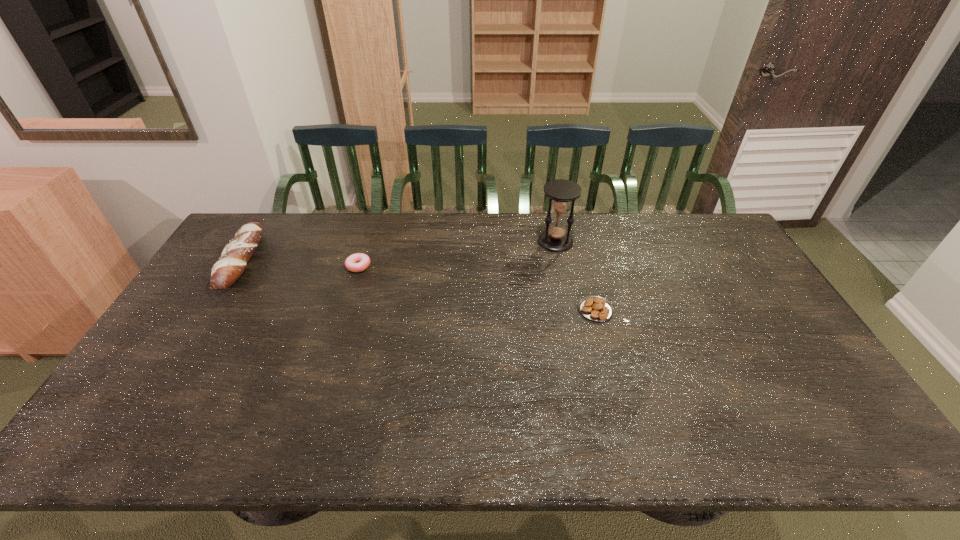
Image resolution: width=960 pixels, height=540 pixels. In order to click on baguet located at the far edge in this screenshot , I will do `click(225, 272)`.

Identify the location of object at the left edge. (225, 272).

The height and width of the screenshot is (540, 960). Identify the location of object present at the far left corner. (225, 272).

Find the location of a particular element. This screenshot has width=960, height=540. vacant space at the far edge is located at coordinates (335, 223).

In the image, there is a desktop. At what (x,y) coordinates should I click in order to perform the action: click on vacant space at the near edge. Please return your answer as a coordinate pair (x, y). The height and width of the screenshot is (540, 960). Looking at the image, I should click on (730, 423).

Identify the location of vacant region at the left edge of the desktop. (160, 346).

Find the location of a particular element. The width and height of the screenshot is (960, 540). free space at the right edge of the desktop is located at coordinates (753, 292).

Where is `vacant space at the far left corner of the desktop`? This screenshot has height=540, width=960. vacant space at the far left corner of the desktop is located at coordinates (283, 218).

The height and width of the screenshot is (540, 960). I want to click on vacant space at the far right corner, so click(x=733, y=251).

I want to click on vacant region at the near right corner, so click(839, 449).